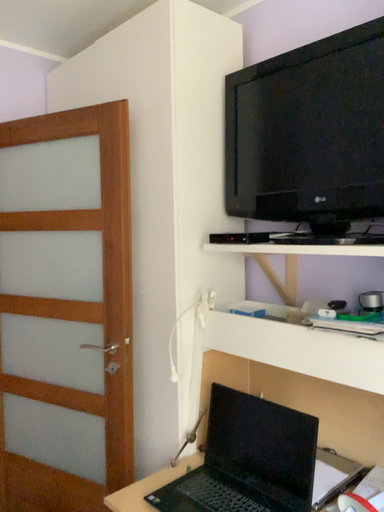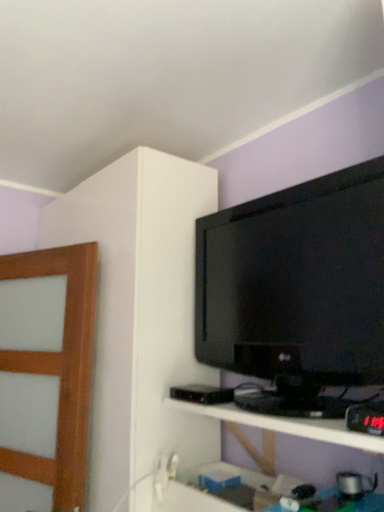
Question: How did the camera likely rotate when shooting the video?

Choices:
 (A) rotated downward
 (B) rotated upward

Answer: (B)